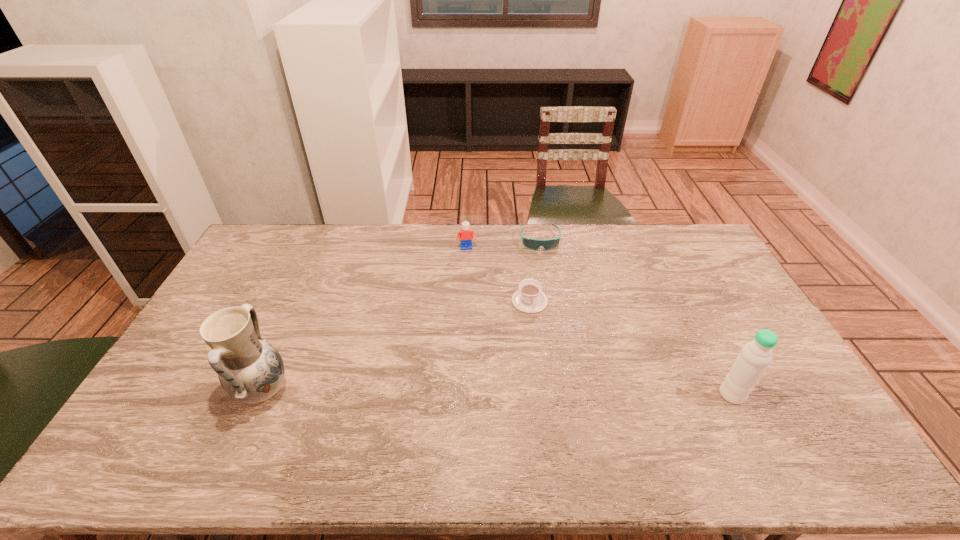
The height and width of the screenshot is (540, 960). What are the coordinates of `the leftmost object` in the screenshot? It's located at (250, 370).

I want to click on water bottle, so click(751, 363).

Locate an element on the screen. the rightmost object is located at coordinates (751, 363).

At what (x,y) coordinates should I click in order to perform the action: click on the third farthest object. Please return your answer as a coordinate pair (x, y). The image size is (960, 540). Looking at the image, I should click on (529, 298).

At what (x,y) coordinates should I click in order to perform the action: click on Lego. Please return your answer as a coordinate pair (x, y). This screenshot has height=540, width=960. Looking at the image, I should click on (466, 235).

Image resolution: width=960 pixels, height=540 pixels. I want to click on the third shortest object, so click(x=466, y=235).

Where is `sunglasses`? sunglasses is located at coordinates click(534, 244).

This screenshot has height=540, width=960. I want to click on vacant space located 0.210m on either side of the pottery, so click(367, 392).

The width and height of the screenshot is (960, 540). Find the location of `free spot located on the left of the water bottle`. free spot located on the left of the water bottle is located at coordinates (636, 395).

Where is `vacant region located 0.210m on the handle side of the teacup`? The image size is (960, 540). vacant region located 0.210m on the handle side of the teacup is located at coordinates (542, 366).